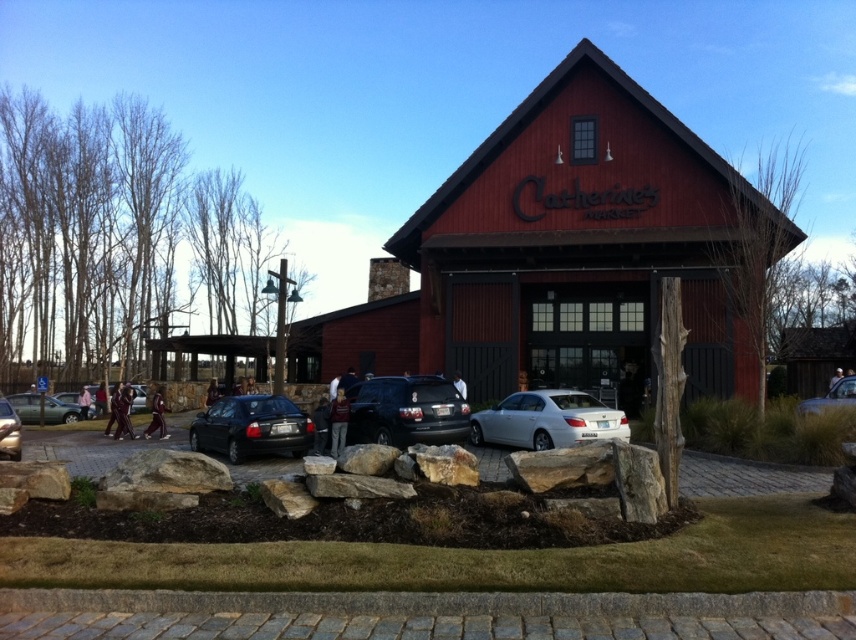
Question: Can you confirm if metallic silver sedan at center is thinner than matte black sedan at center?

Choices:
 (A) yes
 (B) no

Answer: (B)

Question: Among these points, which one is nearest to the camera?

Choices:
 (A) (235, 408)
 (B) (501, 422)

Answer: (A)

Question: Which point appears farthest from the camera in this image?

Choices:
 (A) (571, 173)
 (B) (390, 420)

Answer: (A)

Question: Among these objects, which one is farthest from the camera?

Choices:
 (A) white glossy sedan at center
 (B) shiny black sedan at center
 (C) metallic silver sedan at center

Answer: (B)

Question: Does shiny black sedan at center appear under matte silver sedan at lower left?

Choices:
 (A) yes
 (B) no

Answer: (B)

Question: Does matte red barn at center have a lesser width compared to matte black sedan at center?

Choices:
 (A) yes
 (B) no

Answer: (B)